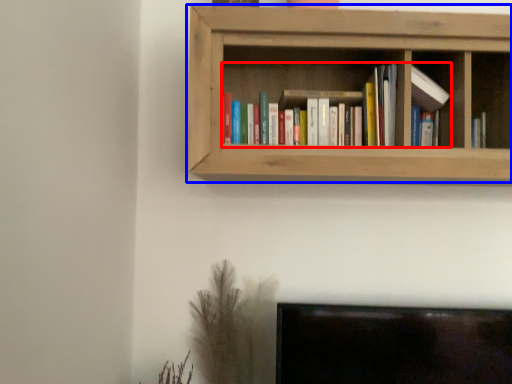
Question: Which point is further to the camera, book (highlighted by a red box) or shelf (highlighted by a blue box)?

Choices:
 (A) book
 (B) shelf

Answer: (A)